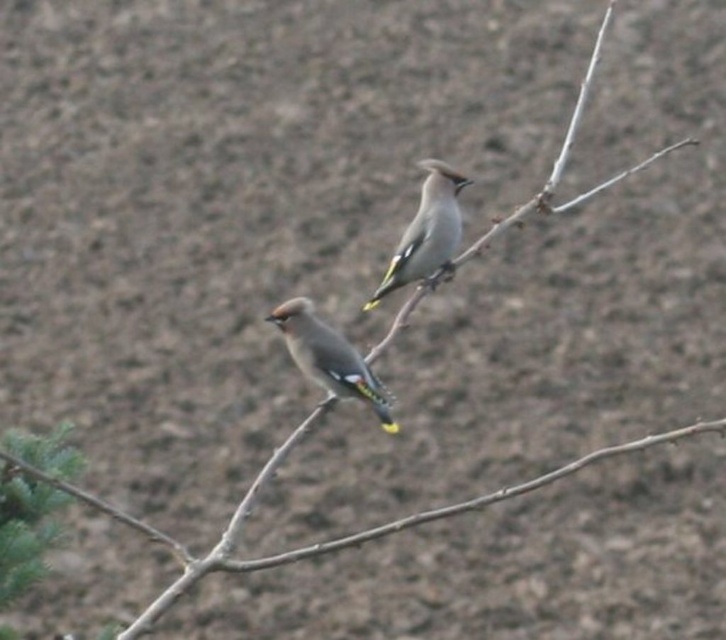
Can you confirm if shiny brown bird at center is bigger than speckled gray bird at center?

No, shiny brown bird at center is not bigger than speckled gray bird at center.

Who is shorter, shiny brown bird at center or speckled gray bird at center?

shiny brown bird at center

The width and height of the screenshot is (726, 640). I want to click on shiny brown bird at center, so click(330, 356).